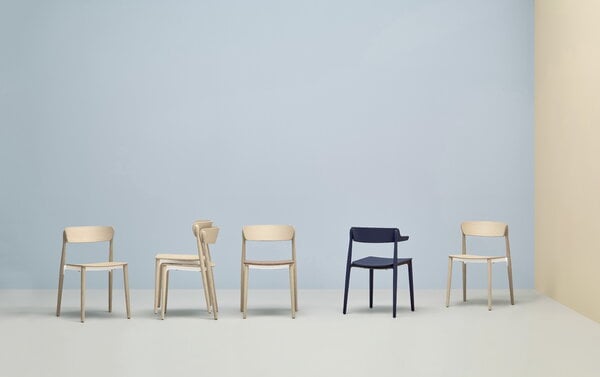
This screenshot has height=377, width=600. I want to click on floor, so click(353, 339).